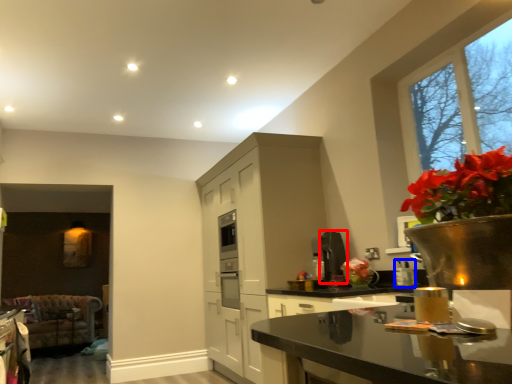
Question: Which point is closer to the camera, appliance (highlighted by a red box) or appliance (highlighted by a blue box)?

Choices:
 (A) appliance
 (B) appliance

Answer: (B)